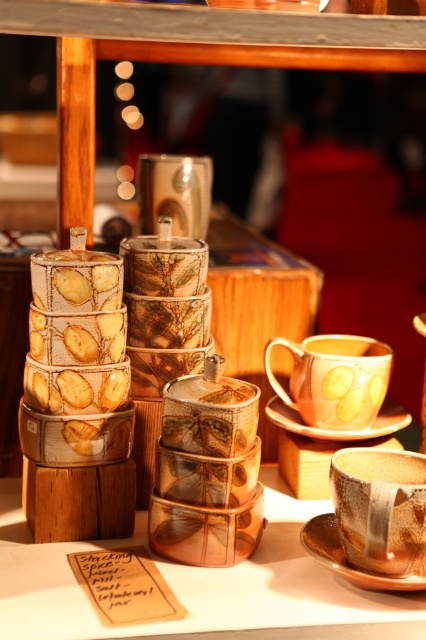
Question: Does matte gold cup at lower right have a lesser width compared to yellow glazed cup at center?

Choices:
 (A) yes
 (B) no

Answer: (A)

Question: Which object appears closest to the camera in this image?

Choices:
 (A) matte gold cup at lower right
 (B) brown ceramic saucer at lower right
 (C) white porcelain saucer at center

Answer: (A)

Question: Considering the relative positions of matte gold cup at lower right and brown ceramic saucer at lower right in the image provided, where is matte gold cup at lower right located with respect to brown ceramic saucer at lower right?

Choices:
 (A) below
 (B) above

Answer: (B)

Question: Considering the real-world distances, which object is closest to the matte gold cup at lower right?

Choices:
 (A) brown ceramic saucer at lower right
 (B) yellow glazed cup at center
 (C) translucent amber glass jars at center
 (D) white porcelain saucer at center

Answer: (A)

Question: Does brown ceramic saucer at lower right appear over white porcelain saucer at center?

Choices:
 (A) no
 (B) yes

Answer: (A)

Question: Based on their relative distances, which object is farther from the translucent amber glass jars at center?

Choices:
 (A) yellow glazed cup at center
 (B) matte gold cup at lower right

Answer: (A)